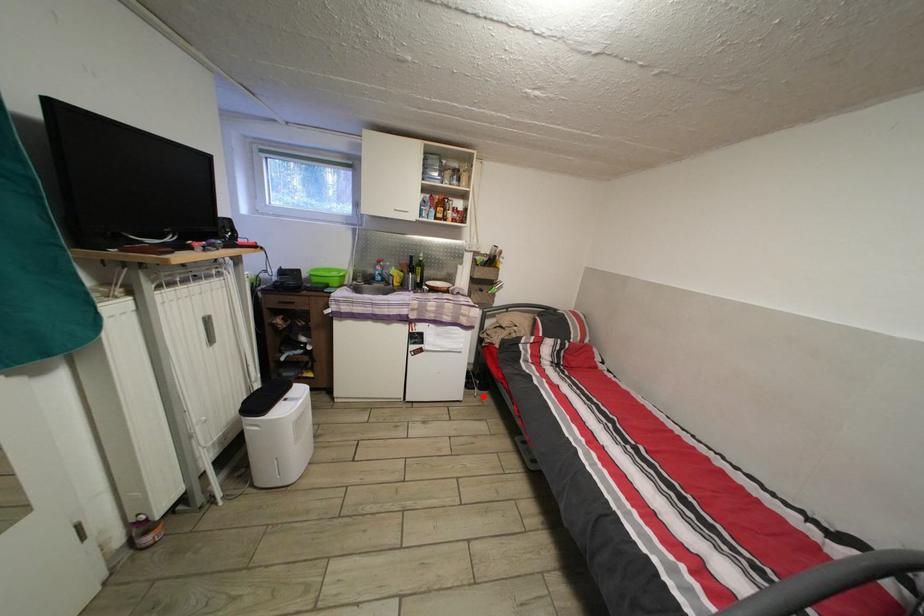
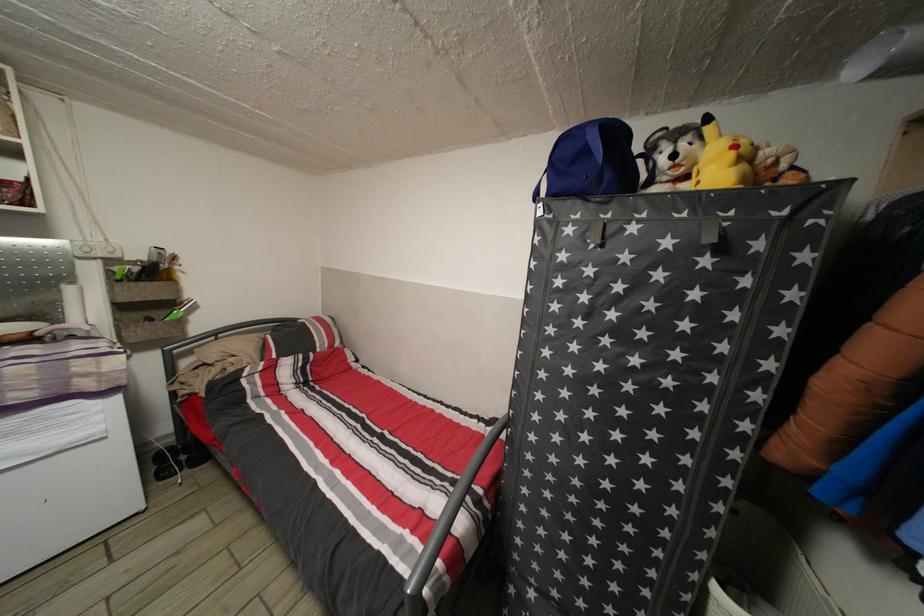
Locate, in the second image, the point that corresponds to the highlighted location in the first image.

(192, 477)